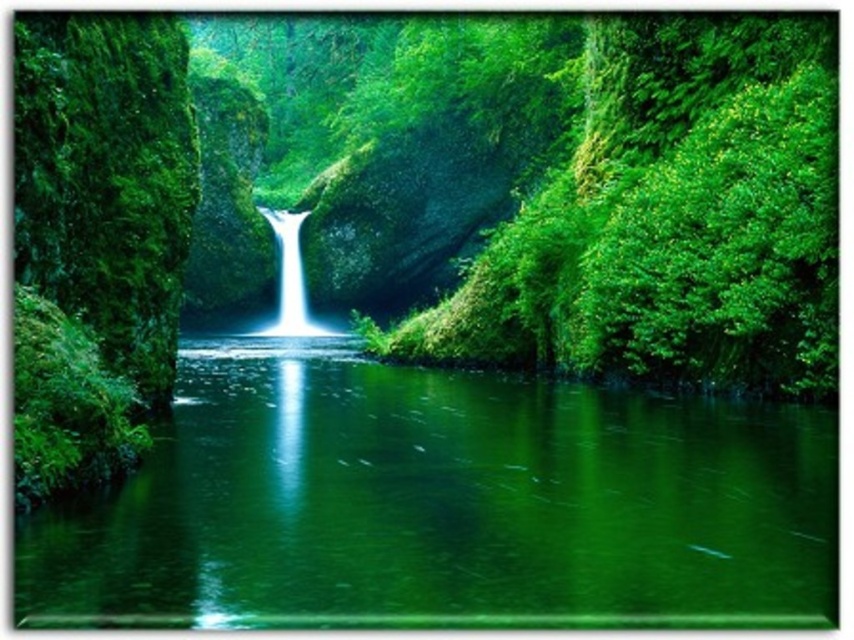
Question: Is green glossy river at center to the right of green mossy rock at left from the viewer's perspective?

Choices:
 (A) yes
 (B) no

Answer: (A)

Question: Is green glossy river at center below green mossy rock at left?

Choices:
 (A) no
 (B) yes

Answer: (B)

Question: Which point is closer to the camera taking this photo?

Choices:
 (A) (320, 460)
 (B) (284, 275)

Answer: (A)

Question: Is green mossy rock at left to the left of white smooth waterfall at center from the viewer's perspective?

Choices:
 (A) no
 (B) yes

Answer: (A)

Question: Which is farther from the green glossy river at center?

Choices:
 (A) green mossy rock at left
 (B) white smooth waterfall at center

Answer: (B)

Question: Which point is farther from the camera taking this photo?

Choices:
 (A) (65, 52)
 (B) (253, 333)
 (C) (102, 529)

Answer: (B)